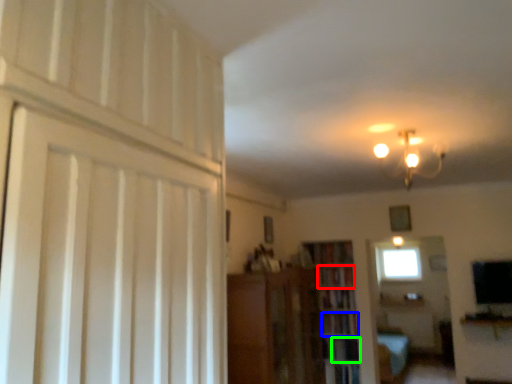
Question: Considering the real-world distances, which object is farthest from book (highlighted by a red box)? book (highlighted by a blue box) or shelf (highlighted by a green box)?

Choices:
 (A) book
 (B) shelf

Answer: (B)